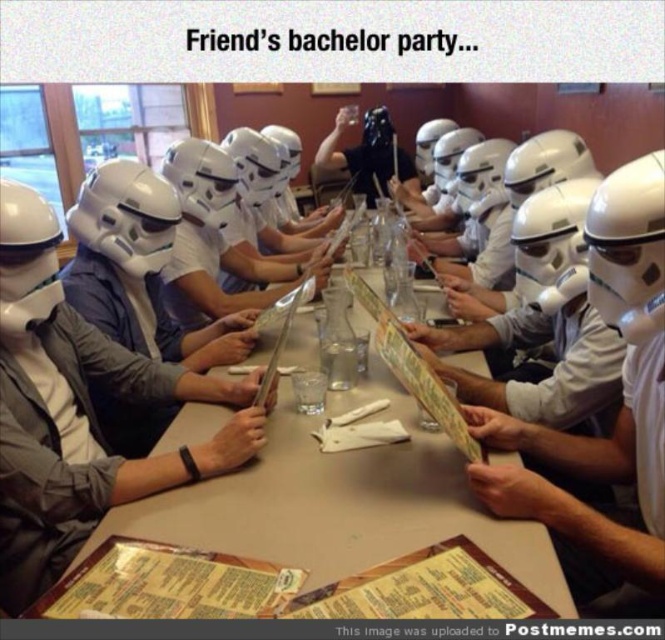
Does white plastic table at center have a smaller size compared to white matte helmet at center?

No.

Does point (392, 396) lie behind point (9, 456)?

Yes, point (392, 396) is farther from viewer.

This screenshot has width=665, height=640. I want to click on white plastic table at center, so click(340, 502).

Who is higher up, white matte helmet at center or matte black helmet at center?

matte black helmet at center is above.

Between point (45, 518) and point (358, 145), which one is positioned in front?

Point (45, 518)

Locate an element on the screen. The height and width of the screenshot is (640, 665). white matte helmet at center is located at coordinates (80, 412).

At what (x,y) coordinates should I click in order to perform the action: click on white matte helmet at center. Please return your answer as a coordinate pair (x, y). The image size is (665, 640). Looking at the image, I should click on (80, 412).

The width and height of the screenshot is (665, 640). I want to click on white plastic table at center, so (340, 502).

Which is more to the left, white plastic table at center or matte black helmet at center?

From the viewer's perspective, white plastic table at center appears more on the left side.

Find the location of a particular element. white plastic table at center is located at coordinates (340, 502).